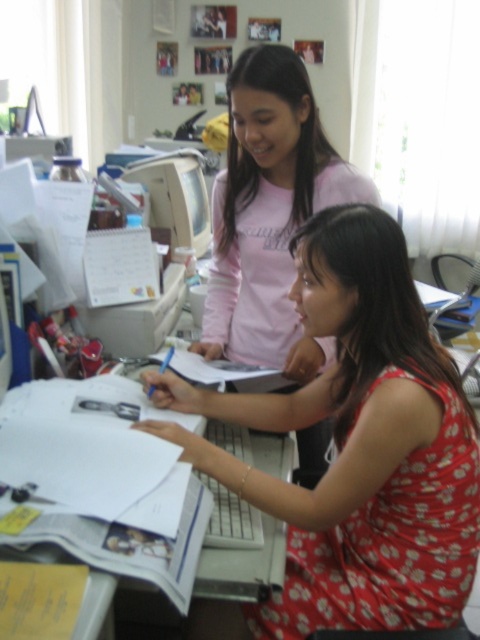
You are organizing a small event and need to determine seating arrangements. The floral fabric dress at center is worn by a guest, and the matte plastic monitor at center is part of the desk setup. If you need to place a chair between them, which object should the chair be closer to to ensure it doesn

The chair should be closer to the matte plastic monitor at center because the floral fabric dress at center is larger in size and may require more space around it to accommodate the guest comfortably.

You are organizing a small event and need to know which item takes up more space for storage. Based on the image, which object occupies more space between the floral fabric dress at center and the pink cotton shirt at upper center?

The pink cotton shirt at upper center occupies more space than the floral fabric dress at center.